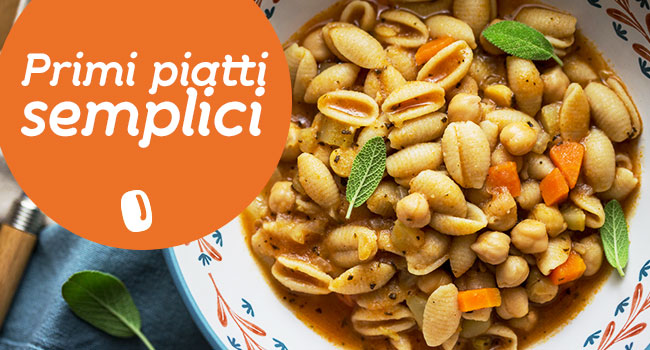
Where is `plate`? This screenshot has width=650, height=350. plate is located at coordinates (222, 286), (603, 323), (629, 39), (280, 9).